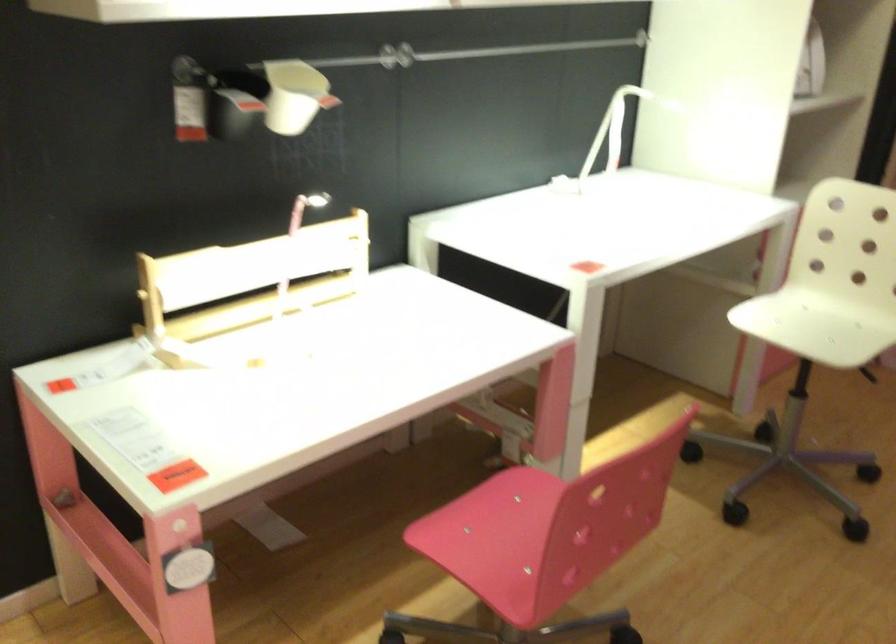
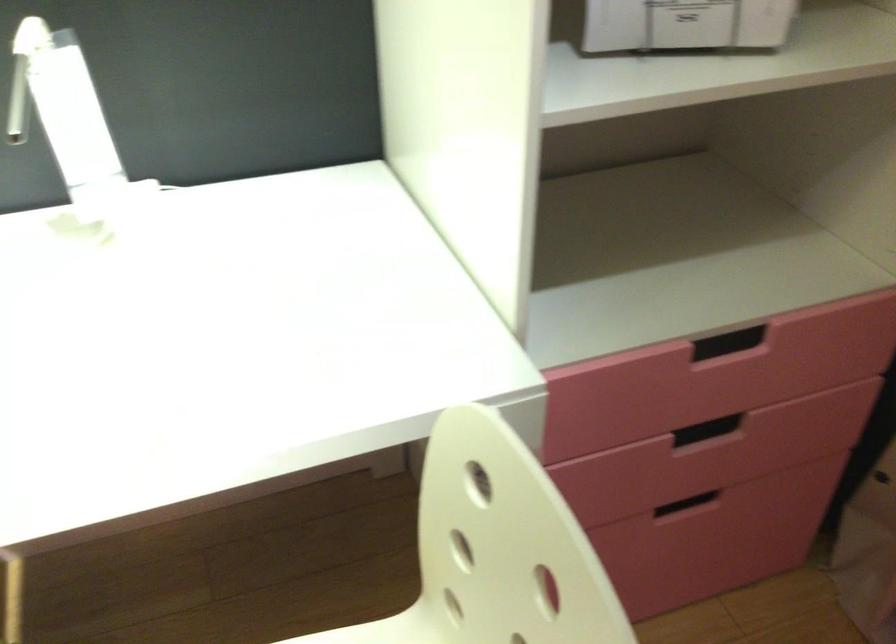
In the second image, find the point that corresponds to [798,79] in the first image.

(685, 24)